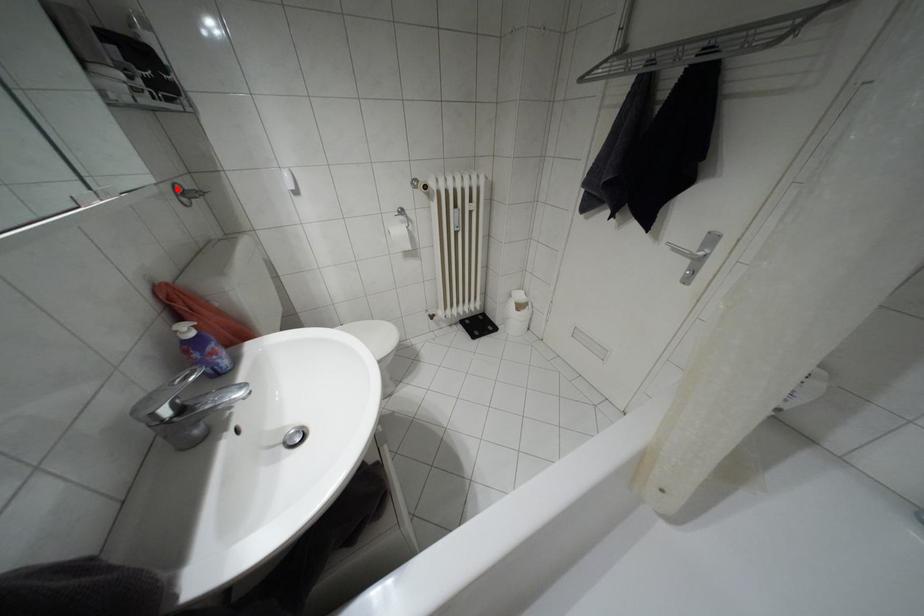
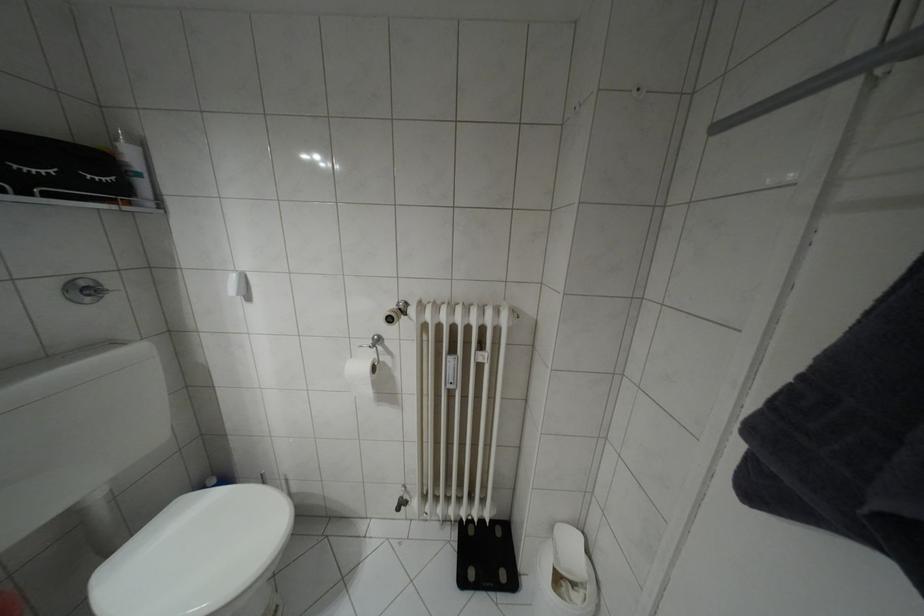
Question: I am providing you with two images of the same scene from different viewpoints. A red point is marked on the first image. At the location where the point appears in image 1, is it still visible in image 2?

Choices:
 (A) Yes
 (B) No

Answer: (A)